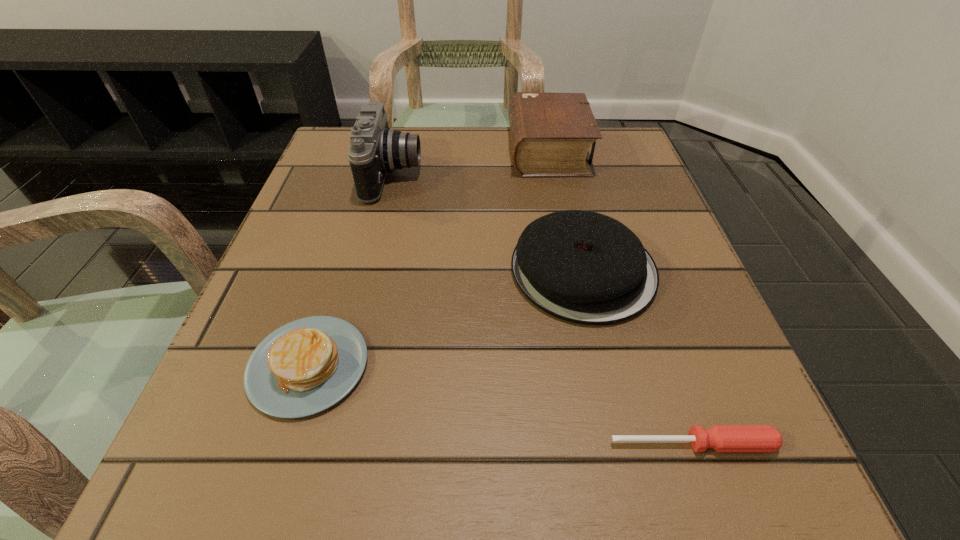
Image resolution: width=960 pixels, height=540 pixels. In order to click on free space located on the spine side of the Bible in this screenshot , I will do `click(425, 151)`.

Locate an element on the screen. vacant area situated 0.170m on the spine side of the Bible is located at coordinates (434, 151).

Image resolution: width=960 pixels, height=540 pixels. I want to click on blank space located on the left of the right pancake, so click(x=337, y=270).

Find the location of a particular element. free location located on the right of the shorter pancake is located at coordinates (659, 366).

Locate an element on the screen. The width and height of the screenshot is (960, 540). free space located 0.360m on the left of the screwdriver is located at coordinates (311, 443).

Locate an element on the screen. This screenshot has height=540, width=960. camera that is at the far edge is located at coordinates (375, 149).

Locate an element on the screen. This screenshot has height=540, width=960. Bible positioned at the far edge is located at coordinates (550, 133).

You are a GUI agent. You are given a task and a screenshot of the screen. Output one action in this format:
    pyautogui.click(x=<x>, y=<y>)
    Task: Click on the object at the near edge
    
    Given the screenshot: What is the action you would take?
    pyautogui.click(x=722, y=438)

Locate an element on the screen. This screenshot has width=960, height=540. camera that is at the left edge is located at coordinates coord(375,149).

Where is `pancake that is at the left edge`? pancake that is at the left edge is located at coordinates (304, 367).